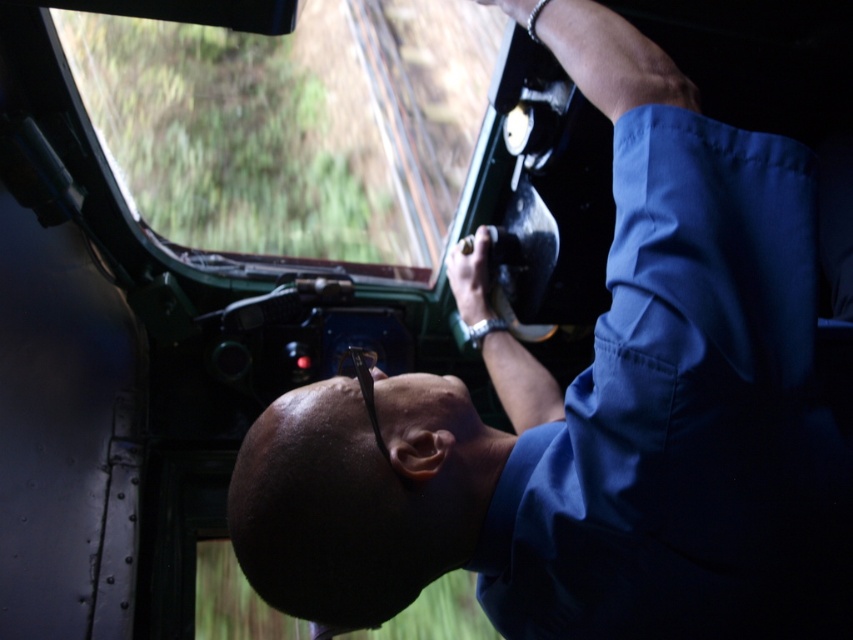
You are a technician inspecting the cockpit of a military helicopter. You notice two points marked at coordinates point (407, 460) and point (415, 248). Which coordinate is closer to your viewpoint as you face the cockpit?

Point (407, 460) is closer to the camera than point (415, 248), so the coordinate point (407, 460) is closer to your viewpoint.

You are a technician inspecting the cockpit of a military helicopter. You notice two points marked at coordinates point [514,19] and point [358,29]. Which point is physically closer to your eyes while standing outside the cockpit?

Point [514,19] is closer to the viewer than point [358,29], so the point [514,19] would be physically closer to your eyes while standing outside the cockpit.

You are a passenger in a helicopter and need to reach the metallic silver train track at upper center to retrieve a dropped item. Can you easily reach it from your current position near the blue fabric shirt at center?

The blue fabric shirt at center is closer to the viewer than the metallic silver train track at upper center, so it may be difficult to reach the metallic silver train track at upper center from the current position near the blue fabric shirt at center due to the distance between them.